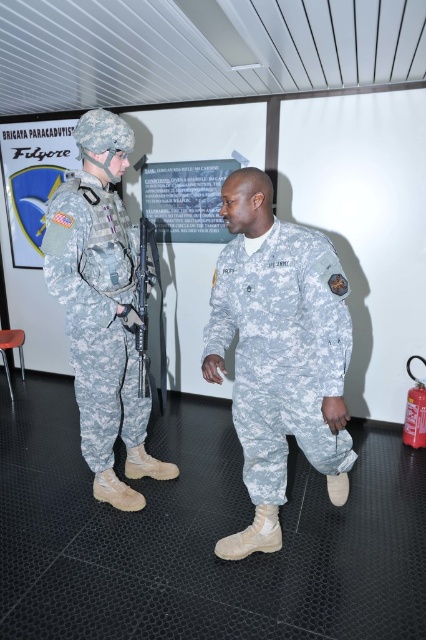
Question: Does camouflage fabric uniform at center come in front of camouflage fabric uniform at left?

Choices:
 (A) no
 (B) yes

Answer: (B)

Question: Can you confirm if camouflage fabric uniform at center is bigger than camouflage fabric uniform at left?

Choices:
 (A) yes
 (B) no

Answer: (A)

Question: Which object appears farthest from the camera in this image?

Choices:
 (A) camouflage fabric uniform at center
 (B) camouflage fabric uniform at left

Answer: (B)

Question: Can you confirm if camouflage fabric uniform at center is positioned above camouflage fabric uniform at left?

Choices:
 (A) no
 (B) yes

Answer: (A)